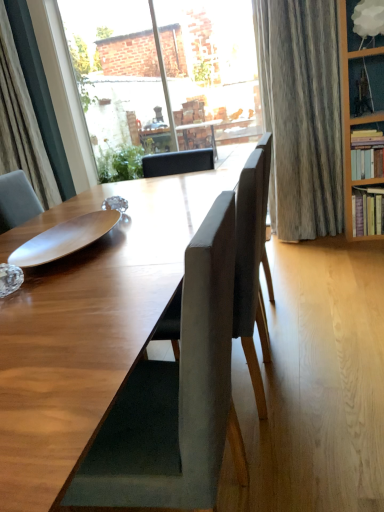
Identify the location of vacant point to the left of hardcover books at right, the 1th shelf from the bottom. (335, 242).